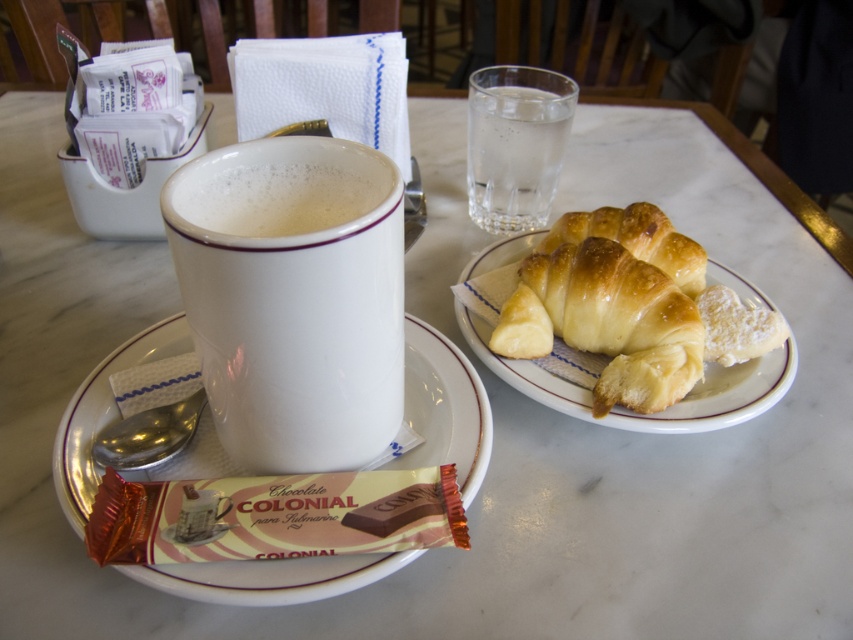
You need to place a 9 inch ruler between the white glossy mug at center and the clear glass water at upper center. Can the ruler fit horizontally between them without touching either object?

The distance between the white glossy mug at center and the clear glass water at upper center is 9.18 inches. Since the ruler is 9 inches long, there is enough space for it to fit horizontally between them without touching either object.

You are a photographer trying to capture the best angle of the breakfast items. You notice two points in the scene marked as point 1 at coordinates (480, 476) and point 2 at coordinates (486, 76). Which point should you focus on first to ensure the foreground item is sharp?

Point 1 at coordinates (480, 476) should be focused on first because it is closer to the camera than point 2 at coordinates (486, 76), ensuring the foreground item remains sharp.

You are a robot with a camera that can only see objects in front of it. You are currently facing the breakfast setting. Which of the two points, point (91,438) or point (608,221), will your camera detect first?

Point (91,438) is in front of point (608,221), so the camera will detect point (91,438) first.